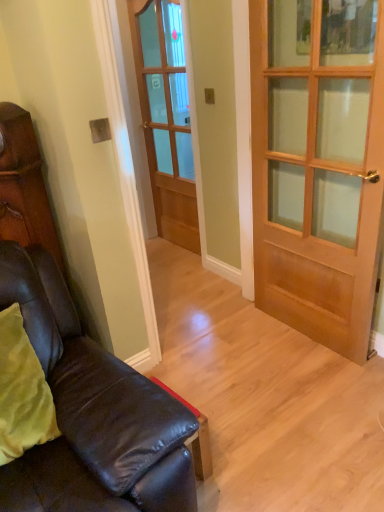
This screenshot has width=384, height=512. I want to click on free area below wooden door at center, arranged as the second door when viewed from the back (from a real-world perspective), so click(298, 335).